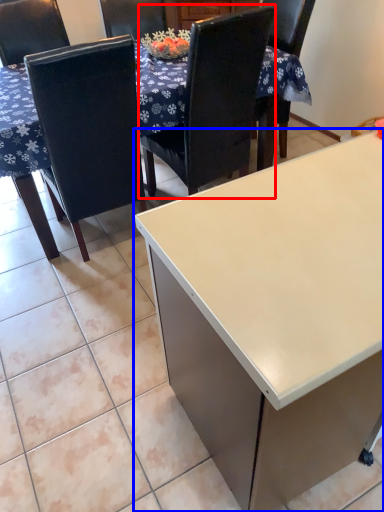
Question: Among these objects, which one is nearest to the camera, chair (highlighted by a red box) or desk (highlighted by a blue box)?

Choices:
 (A) chair
 (B) desk

Answer: (B)